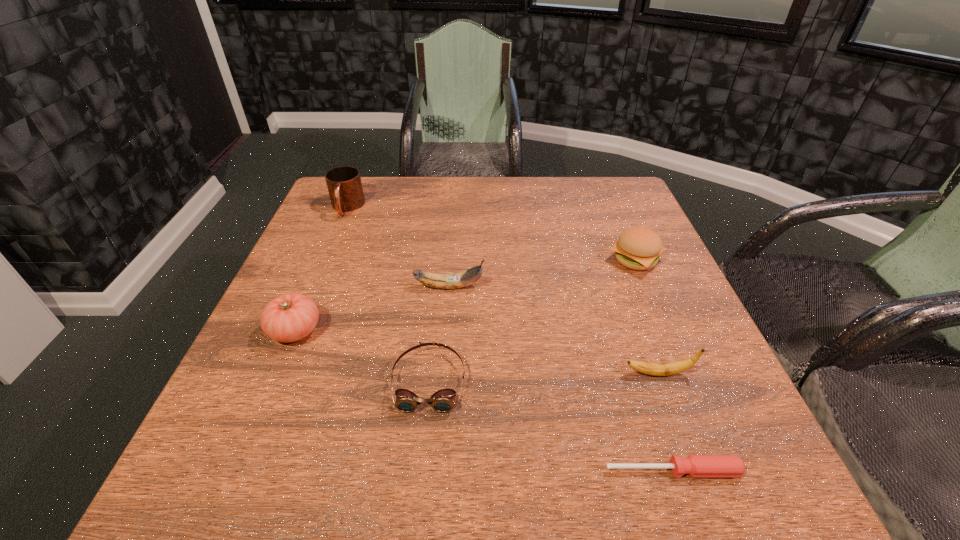
Where is `object situated at the near edge`? object situated at the near edge is located at coordinates (695, 465).

Where is `mug at the left edge`? Image resolution: width=960 pixels, height=540 pixels. mug at the left edge is located at coordinates click(344, 184).

In order to click on tomato that is at the left edge in this screenshot , I will do `click(289, 317)`.

This screenshot has height=540, width=960. I want to click on hamburger present at the right edge, so click(x=638, y=248).

Identify the location of banana that is at the right edge. This screenshot has height=540, width=960. (671, 368).

Where is `screwdriver located in the right edge section of the desktop`? Image resolution: width=960 pixels, height=540 pixels. screwdriver located in the right edge section of the desktop is located at coordinates (695, 465).

Image resolution: width=960 pixels, height=540 pixels. Find the location of `object present at the far left corner`. object present at the far left corner is located at coordinates (344, 184).

Locate an element on the screen. The image size is (960, 540). object present at the near right corner is located at coordinates (695, 465).

The width and height of the screenshot is (960, 540). In the image, there is a desktop. Find the location of `free space at the far edge`. free space at the far edge is located at coordinates (445, 186).

Image resolution: width=960 pixels, height=540 pixels. I want to click on free region at the near edge of the desktop, so click(396, 465).